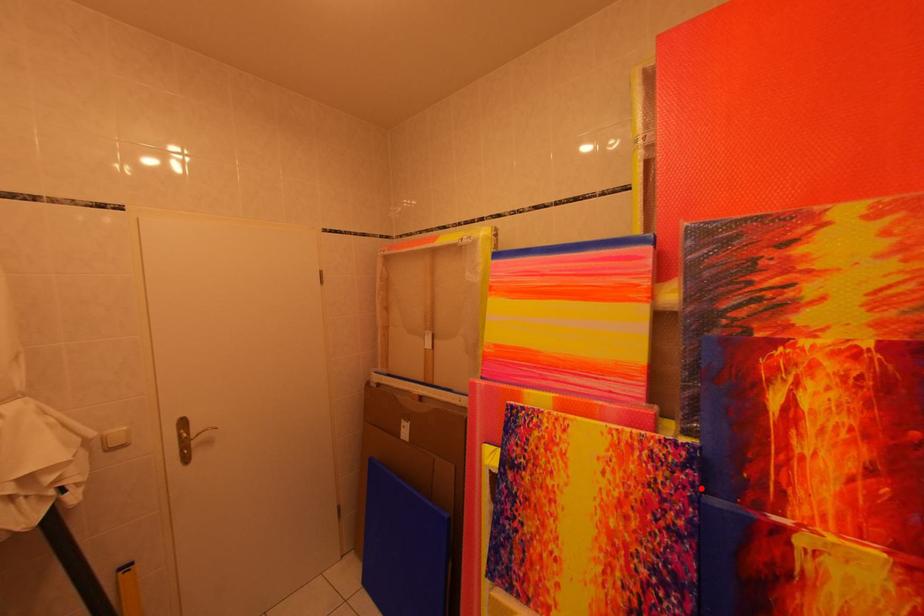
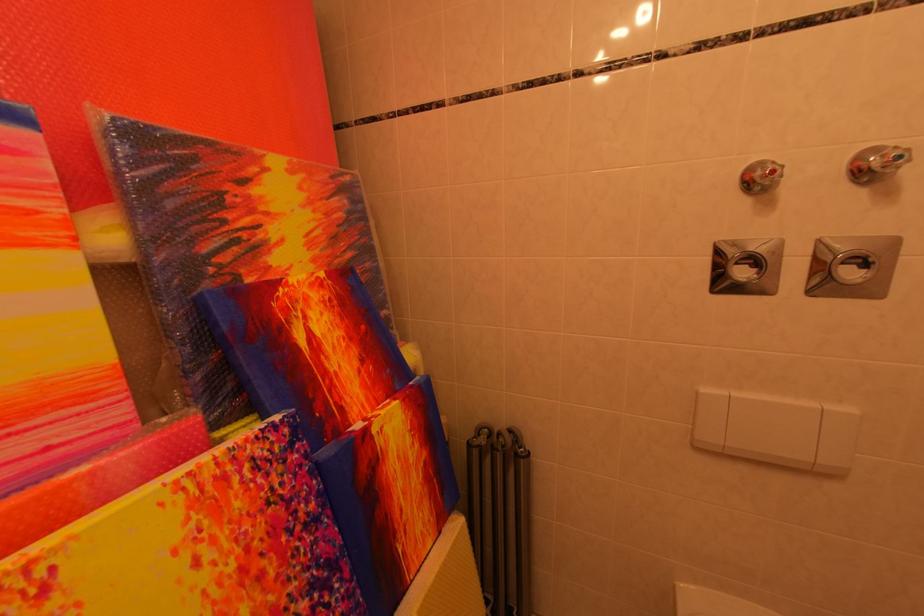
Locate, in the second image, the point that corresponds to the highlighted location in the first image.

(313, 460)